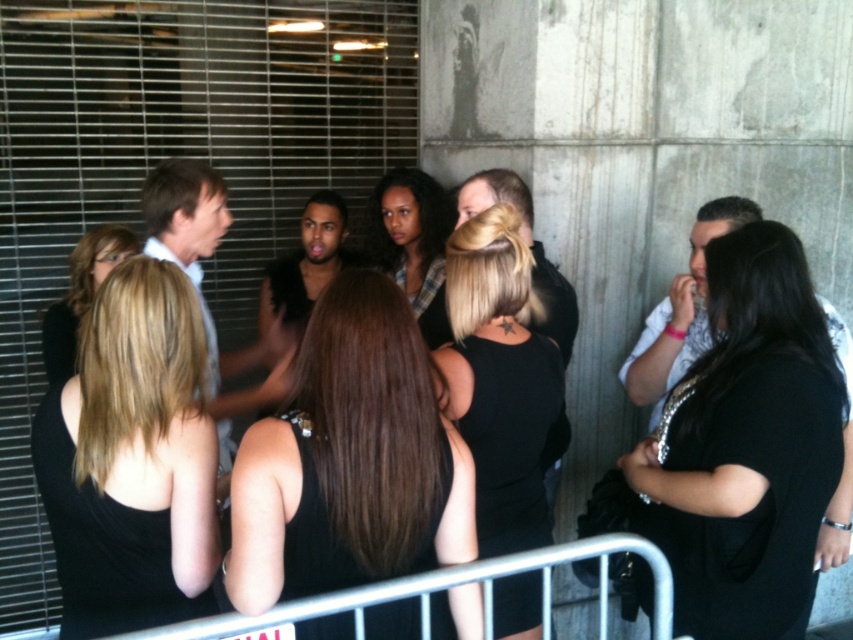
Question: Considering the real-world distances, which object is farthest from the black matte tank top at center?

Choices:
 (A) silver metallic rail at lower center
 (B) shiny black tank top at center
 (C) black sequined dress at right
 (D) matte black tank top at left

Answer: (C)

Question: Which object is farther from the camera taking this photo?

Choices:
 (A) black sequined dress at right
 (B) black matte dress at center

Answer: (B)

Question: Which point is farther to the camera?

Choices:
 (A) (730, 356)
 (B) (180, 625)
 (C) (85, 304)

Answer: (C)

Question: Is shiny black tank top at center wider than matte black tank top at left?

Choices:
 (A) yes
 (B) no

Answer: (A)

Question: Does black sequined dress at right have a greater width compared to matte black hair at center?

Choices:
 (A) yes
 (B) no

Answer: (A)

Question: Is the position of black sequined dress at right more distant than that of matte black tank top at left?

Choices:
 (A) yes
 (B) no

Answer: (B)